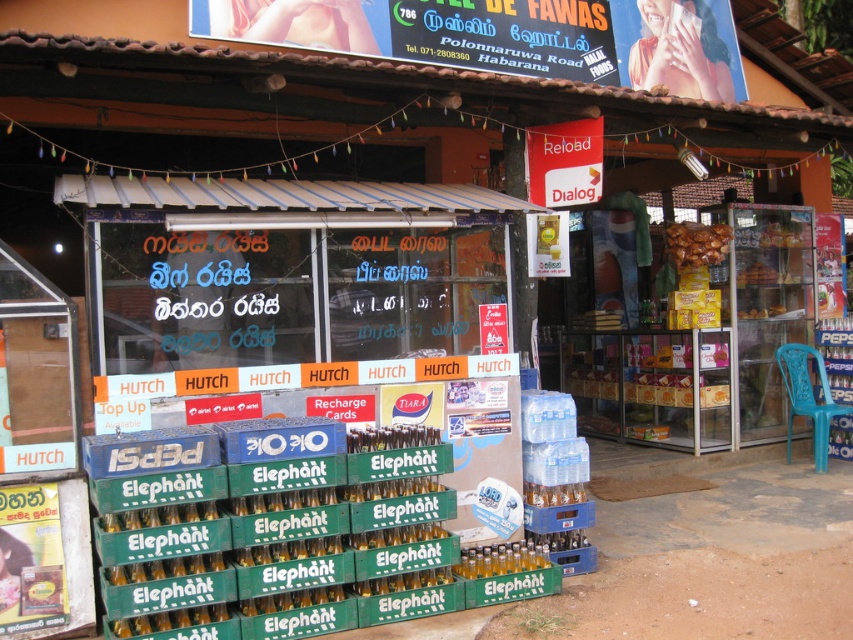
Who is shorter, white paper sign at upper center or brown crispy snack at right?

With less height is brown crispy snack at right.

Does white paper sign at upper center have a larger size compared to brown crispy snack at right?

Indeed, white paper sign at upper center has a larger size compared to brown crispy snack at right.

Describe the element at coordinates (564, 163) in the screenshot. I see `white paper sign at upper center` at that location.

The width and height of the screenshot is (853, 640). Find the location of `white paper sign at upper center`. white paper sign at upper center is located at coordinates (564, 163).

Which is in front, point (589, 42) or point (785, 355)?

Point (589, 42) is in front.

Is the position of black plastic signboard at upper center less distant than that of blue plastic chair at right?

Yes, black plastic signboard at upper center is in front of blue plastic chair at right.

Measure the distance between point (456, 35) and camera.

Point (456, 35) and camera are 7.21 meters apart.

You are a GUI agent. You are given a task and a screenshot of the screen. Output one action in this format:
    pyautogui.click(x=<x>, y=<y>)
    Task: Click on the black plastic signboard at upper center
    The image size is (853, 640).
    Given the screenshot: What is the action you would take?
    pyautogui.click(x=508, y=36)

Between point (825, 410) and point (708, 228), which one is positioned behind?

Positioned behind is point (708, 228).

What do you see at coordinates (807, 397) in the screenshot? I see `blue plastic chair at right` at bounding box center [807, 397].

Find the location of a particular element. Image resolution: width=853 pixels, height=640 pixels. blue plastic chair at right is located at coordinates (807, 397).